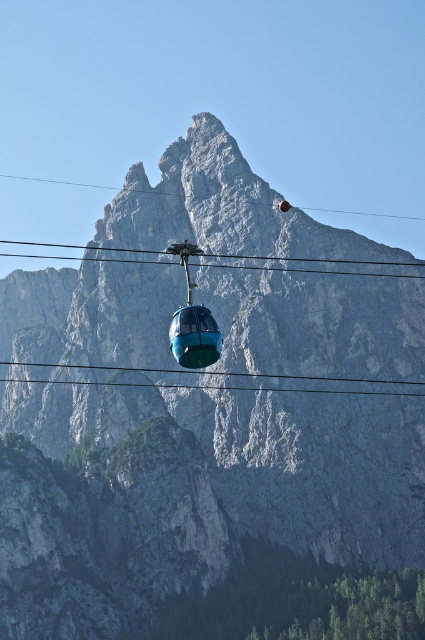
Looking at this image, you are a tourist standing at the base of the mountain and looking up at the blue glassy gondola at center and the transparent cable at upper center. Which object appears nearer to you?

The blue glassy gondola at center is closer to the viewer than the transparent cable at upper center, so the blue glassy gondola at center appears nearer to you.